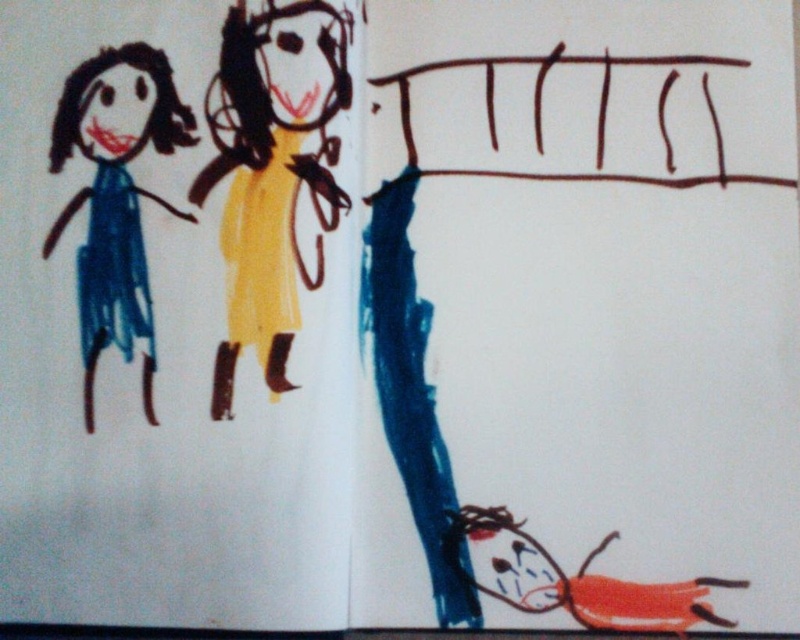
Is yellow paper doll at center to the left of matte blue dress at left from the viewer's perspective?

Incorrect, yellow paper doll at center is not on the left side of matte blue dress at left.

Between point (260, 173) and point (112, 260), which one is positioned behind?

Point (112, 260)

Measure the distance between point [236,308] and camera.

Point [236,308] and camera are 33.86 inches apart from each other.

Where is `yellow paper doll at center`? Image resolution: width=800 pixels, height=640 pixels. yellow paper doll at center is located at coordinates (272, 172).